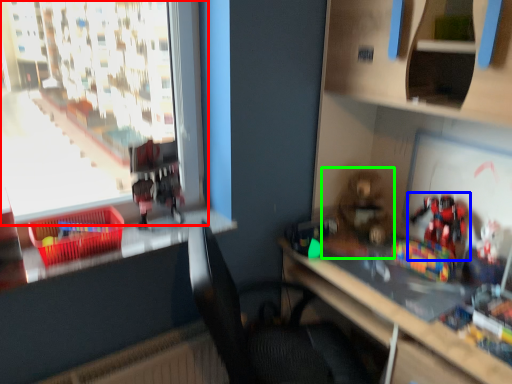
Question: Which is farther away from window (highlighted by a red box)? toy (highlighted by a blue box) or toy (highlighted by a green box)?

Choices:
 (A) toy
 (B) toy

Answer: (A)